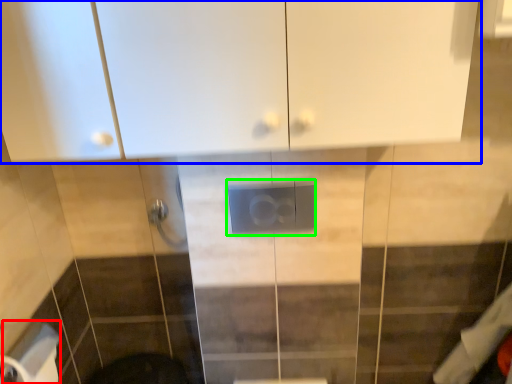
Question: Estimate the real-world distances between objects in this image. Which object is closer to toilet paper (highlighted by a red box), cabinetry (highlighted by a blue box) or electric outlet (highlighted by a green box)?

Choices:
 (A) cabinetry
 (B) electric outlet

Answer: (B)